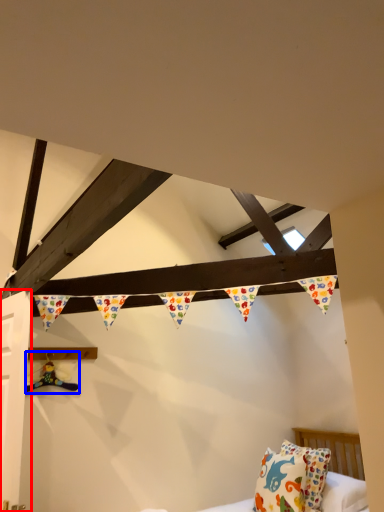
Question: Which object appears closest to the camera in this image, door (highlighted by a red box) or toy (highlighted by a blue box)?

Choices:
 (A) door
 (B) toy

Answer: (A)